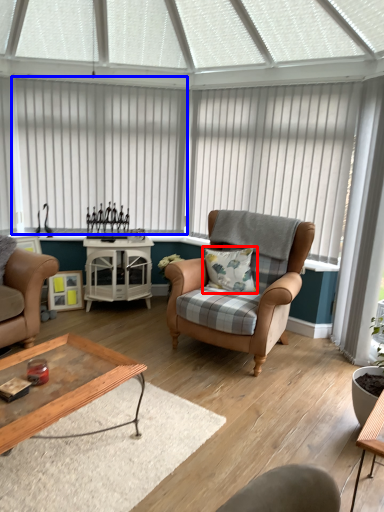
Question: Which object is further to the camera taking this photo, pillow (highlighted by a red box) or blind (highlighted by a blue box)?

Choices:
 (A) pillow
 (B) blind

Answer: (B)